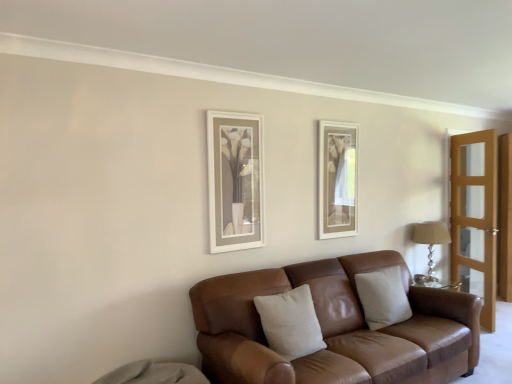
Question: Is light brown wooden screen door at right smaller than beige cotton pillow at center, the 1th pillow when ordered from left to right?

Choices:
 (A) no
 (B) yes

Answer: (A)

Question: Can you confirm if light brown wooden screen door at right is taller than beige cotton pillow at center, positioned as the 2th pillow in back-to-front order?

Choices:
 (A) yes
 (B) no

Answer: (A)

Question: Are light brown wooden screen door at right and beige cotton pillow at center, the 1th pillow when ordered from left to right, located far from each other?

Choices:
 (A) no
 (B) yes

Answer: (B)

Question: Is light brown wooden screen door at right facing towards beige cotton pillow at center, which is the second pillow from right to left?

Choices:
 (A) no
 (B) yes

Answer: (A)

Question: From a real-world perspective, is light brown wooden screen door at right beneath beige cotton pillow at center, the 1th pillow when ordered from left to right?

Choices:
 (A) yes
 (B) no

Answer: (B)

Question: Is the position of light brown wooden screen door at right more distant than that of beige cotton pillow at center, positioned as the 2th pillow in back-to-front order?

Choices:
 (A) yes
 (B) no

Answer: (A)

Question: Can you confirm if silver glass table lamp at right is bigger than brown leather couch at center?

Choices:
 (A) no
 (B) yes

Answer: (A)

Question: From a real-world perspective, is silver glass table lamp at right under brown leather couch at center?

Choices:
 (A) no
 (B) yes

Answer: (A)

Question: Is silver glass table lamp at right with brown leather couch at center?

Choices:
 (A) yes
 (B) no

Answer: (B)

Question: Considering the relative sizes of silver glass table lamp at right and brown leather couch at center in the image provided, is silver glass table lamp at right thinner than brown leather couch at center?

Choices:
 (A) yes
 (B) no

Answer: (A)

Question: Considering the relative sizes of silver glass table lamp at right and brown leather couch at center in the image provided, is silver glass table lamp at right wider than brown leather couch at center?

Choices:
 (A) yes
 (B) no

Answer: (B)

Question: Is brown leather couch at center completely or partially inside silver glass table lamp at right?

Choices:
 (A) yes
 (B) no

Answer: (B)

Question: Is beige cotton pillow at center, which is the second pillow from right to left, facing away from brown leather couch at center?

Choices:
 (A) yes
 (B) no

Answer: (A)